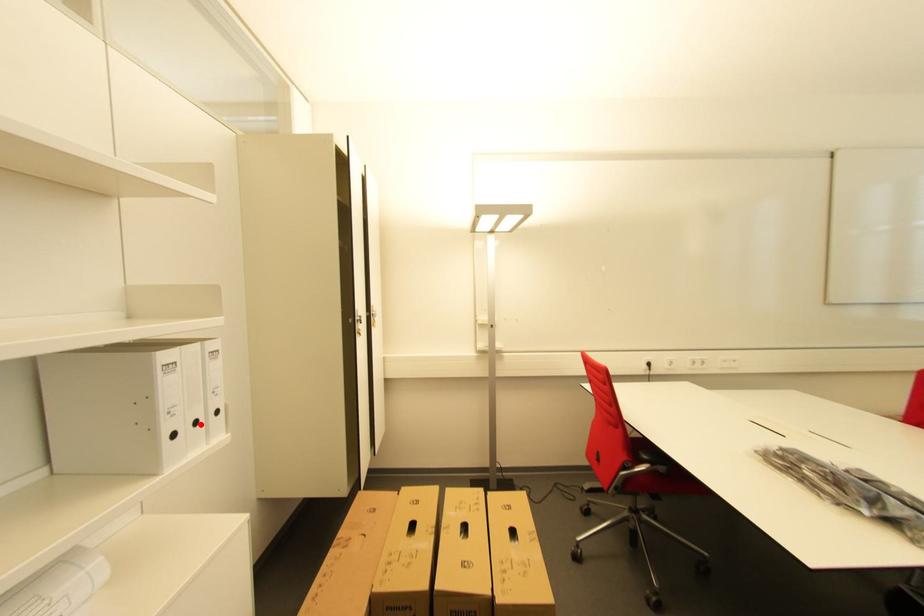
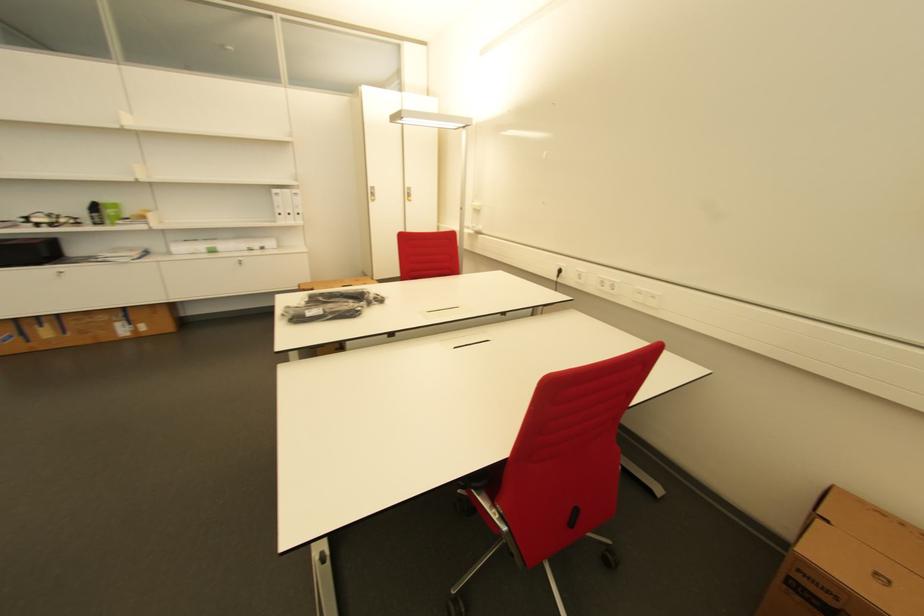
Question: A red point is marked in image1. In image2, is the corresponding 3D point closer to the camera or farther? Reply with the corresponding letter.

Choices:
 (A) The corresponding 3D point is closer.
 (B) The corresponding 3D point is farther.

Answer: (A)